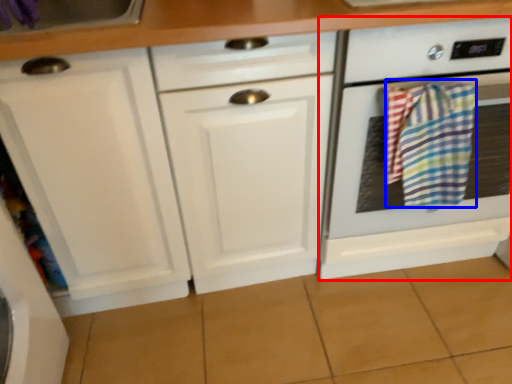
Question: Which object appears farthest to the camera in this image, home appliance (highlighted by a red box) or beach towel (highlighted by a blue box)?

Choices:
 (A) home appliance
 (B) beach towel

Answer: (B)